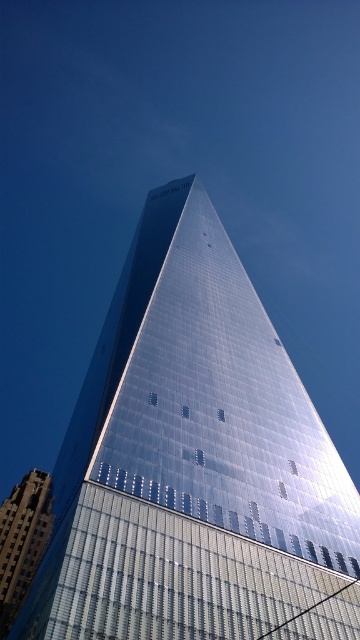
Question: Can you confirm if shiny glass skyscraper at center is thinner than dark brown brick building at lower left?

Choices:
 (A) no
 (B) yes

Answer: (A)

Question: Among these objects, which one is nearest to the camera?

Choices:
 (A) dark brown brick building at lower left
 (B) shiny glass skyscraper at center

Answer: (B)

Question: Does shiny glass skyscraper at center have a smaller size compared to dark brown brick building at lower left?

Choices:
 (A) yes
 (B) no

Answer: (B)

Question: Is the position of shiny glass skyscraper at center more distant than that of dark brown brick building at lower left?

Choices:
 (A) no
 (B) yes

Answer: (A)